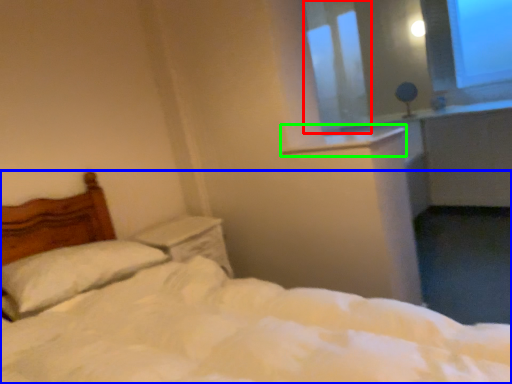
Question: Based on their relative distances, which object is nearer to window screen (highlighted by a red box)? Choose from bed (highlighted by a blue box) and window sill (highlighted by a green box).

Choices:
 (A) bed
 (B) window sill

Answer: (B)